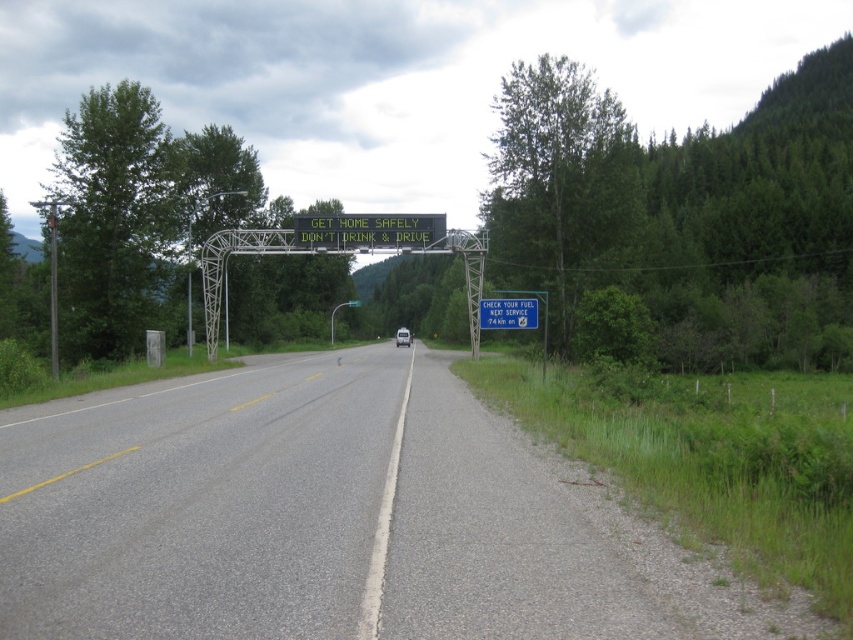
Can you confirm if green electronic sign at center is positioned to the left of blue plastic sign at center?

Yes, green electronic sign at center is to the left of blue plastic sign at center.

Between green electronic sign at center and blue plastic sign at center, which one appears on the right side from the viewer's perspective?

blue plastic sign at center is more to the right.

Where is `green electronic sign at center`? Image resolution: width=853 pixels, height=640 pixels. green electronic sign at center is located at coordinates (368, 230).

Between blue plastic sign at center and white matte van at center, which one has less height?

blue plastic sign at center is shorter.

Can you confirm if blue plastic sign at center is bigger than white matte van at center?

No, blue plastic sign at center is not bigger than white matte van at center.

At what (x,y) coordinates should I click in order to perform the action: click on blue plastic sign at center. Please return your answer as a coordinate pair (x, y). Looking at the image, I should click on (508, 314).

Measure the distance between point (300, 244) and camera.

Point (300, 244) is 45.35 meters from camera.

In the scene shown: Is the position of green electronic sign at center less distant than that of white matte van at center?

Yes, it is in front of white matte van at center.

Locate an element on the screen. green electronic sign at center is located at coordinates (368, 230).

Identify the location of green electronic sign at center. This screenshot has width=853, height=640. (368, 230).